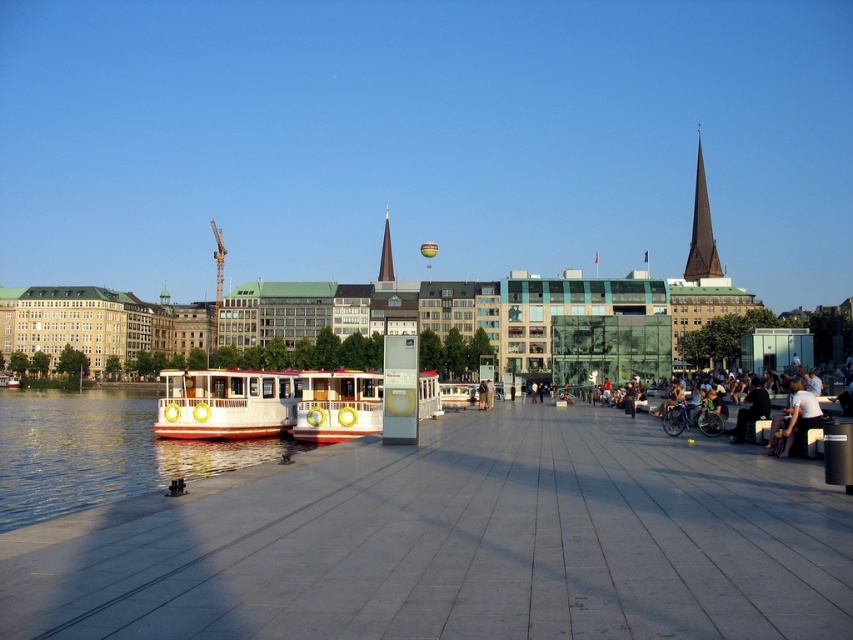
Can you confirm if white glossy water at lower left is positioned above white polished wood boat at left?

No, white glossy water at lower left is not above white polished wood boat at left.

Does white glossy water at lower left have a lesser width compared to white polished wood boat at left?

Incorrect, white glossy water at lower left's width is not less than white polished wood boat at left's.

Identify the location of white glossy water at lower left. This screenshot has height=640, width=853. (99, 452).

Between point (431, 632) and point (746, 406), which one is positioned behind?

Point (746, 406)

Is white concrete dock at center further to camera compared to dark gray fabric jacket at lower right?

No, it is not.

Where is `white concrete dock at center`? This screenshot has height=640, width=853. white concrete dock at center is located at coordinates [x=459, y=544].

You are a GUI agent. You are given a task and a screenshot of the screen. Output one action in this format:
    pyautogui.click(x=<x>, y=<y>)
    Task: Click on the white concrete dock at center
    The height and width of the screenshot is (640, 853).
    Given the screenshot: What is the action you would take?
    pyautogui.click(x=459, y=544)

In the scene shown: Who is taller, white concrete dock at center or white polished wood boat at left?

white polished wood boat at left

Can you confirm if white concrete dock at center is positioned below white polished wood boat at left?

Yes, white concrete dock at center is below white polished wood boat at left.

Who is more distant from viewer, (120,598) or (231,422)?

The point (231,422) is more distant.

Where is `white concrete dock at center`? white concrete dock at center is located at coordinates (459, 544).